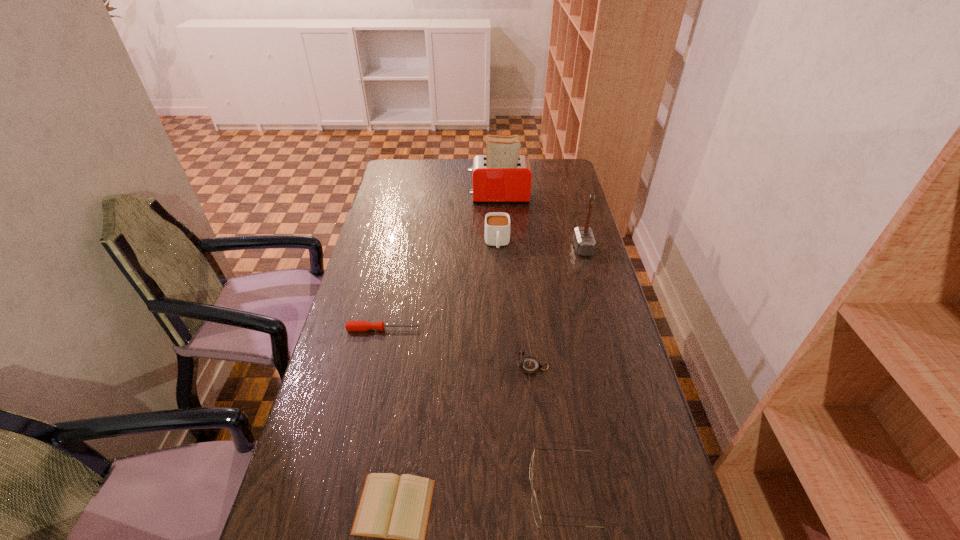
The image size is (960, 540). I want to click on toaster, so click(x=502, y=175).

Identify the location of the second tallest object. coord(583,238).

Where is `the rightmost object`? This screenshot has width=960, height=540. the rightmost object is located at coordinates (583, 238).

Locate an element on the screen. This screenshot has height=540, width=960. cup is located at coordinates (497, 224).

Locate an element on the screen. This screenshot has height=540, width=960. the fourth shortest object is located at coordinates (530, 365).

In order to click on the fifth farthest object in this screenshot , I will do `click(530, 365)`.

This screenshot has height=540, width=960. In order to click on the third shortest object in this screenshot , I will do `click(536, 513)`.

Locate an element on the screen. screwdriver is located at coordinates (350, 325).

The width and height of the screenshot is (960, 540). Identify the location of the sixth tallest object. [350, 325].

I want to click on vacant region located on the front-facing side of the farthest object, so click(x=443, y=197).